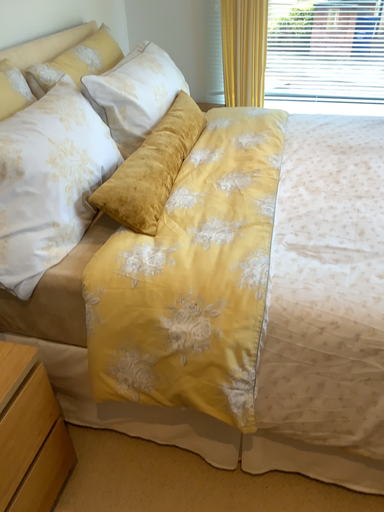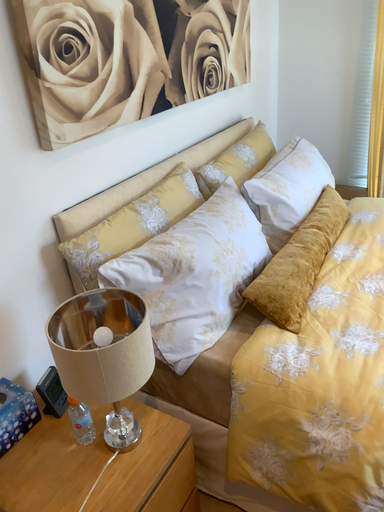
Question: Which way did the camera rotate in the video?

Choices:
 (A) rotated left
 (B) rotated right

Answer: (A)